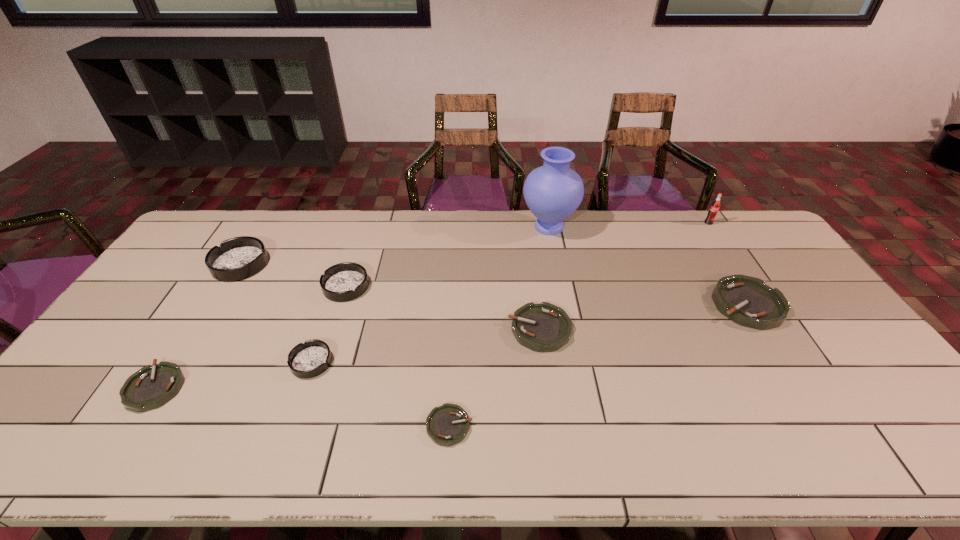
Identify the location of vacant space in between the second smallest green ashtray and the rightmost ashtray. This screenshot has height=540, width=960. (451, 346).

Identify the location of vacant space in between the third tallest object and the smallest dark ashtray. [x=276, y=313].

Image resolution: width=960 pixels, height=540 pixels. Identify the location of free space between the second ashtray from right to left and the second biggest dark ashtray. (443, 308).

Locate an element on the screen. unoccupied position between the second green ashtray from left to right and the second smallest dark ashtray is located at coordinates (397, 356).

I want to click on object that is the fourth closest to the nearest dark ashtray, so click(x=238, y=258).

Select which object is the sixth closest to the shortest ashtray. Please provide its 2D coordinates. Your answer should be formatted as a tuple, i.e. [(x, y)], where the tuple contains the x and y coordinates of a point satisfying the conditions above.

[(238, 258)]

Locate which ashtray ranks sixth in proximity to the second smallest dark ashtray. Please provide its 2D coordinates. Your answer should be formatted as a tuple, i.e. [(x, y)], where the tuple contains the x and y coordinates of a point satisfying the conditions above.

[(748, 301)]

Identify which ashtray is the third nearest to the nearest dark ashtray. Please provide its 2D coordinates. Your answer should be formatted as a tuple, i.e. [(x, y)], where the tuple contains the x and y coordinates of a point satisfying the conditions above.

[(446, 425)]

You are a GUI agent. You are given a task and a screenshot of the screen. Output one action in this format:
    pyautogui.click(x=<x>, y=<y>)
    Task: Click on the second closest dark ashtray to the second shortest object
    This screenshot has width=960, height=540.
    Given the screenshot: What is the action you would take?
    pyautogui.click(x=238, y=258)

Select which dark ashtray is the second closest to the nearest dark ashtray. Please provide its 2D coordinates. Your answer should be formatted as a tuple, i.e. [(x, y)], where the tuple contains the x and y coordinates of a point satisfying the conditions above.

[(238, 258)]